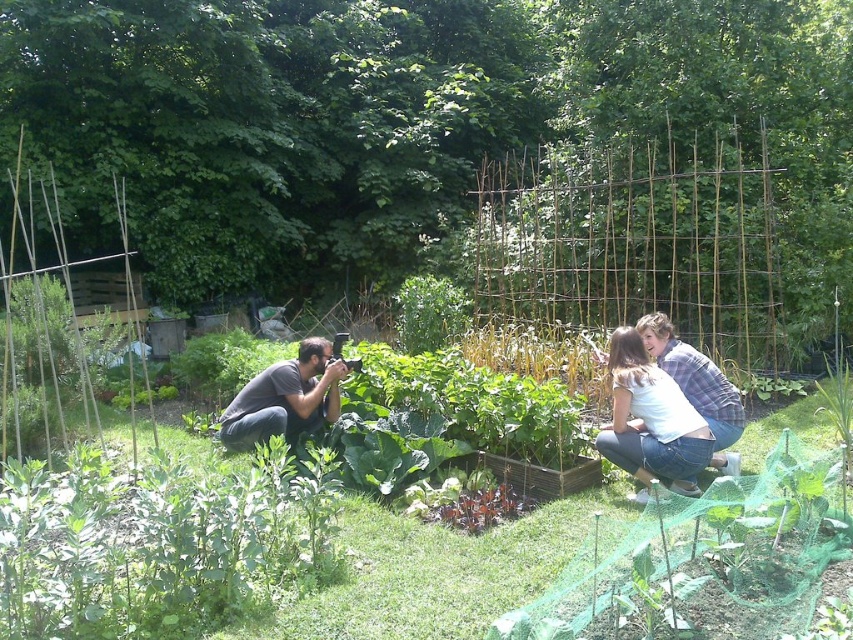
Question: Does matte gray shirt at lower left have a lesser width compared to white cotton shirt at center?

Choices:
 (A) no
 (B) yes

Answer: (A)

Question: Can you confirm if matte gray shirt at lower left is positioned to the right of white cotton shirt at center?

Choices:
 (A) yes
 (B) no

Answer: (B)

Question: Which of the following is the farthest from the observer?

Choices:
 (A) (654, 356)
 (B) (270, 404)

Answer: (B)

Question: Which point is closer to the camera?

Choices:
 (A) white cotton shirt at center
 (B) matte gray shirt at lower left

Answer: (A)

Question: Can you confirm if matte gray shirt at lower left is positioned below white cotton shirt at center?

Choices:
 (A) no
 (B) yes

Answer: (B)